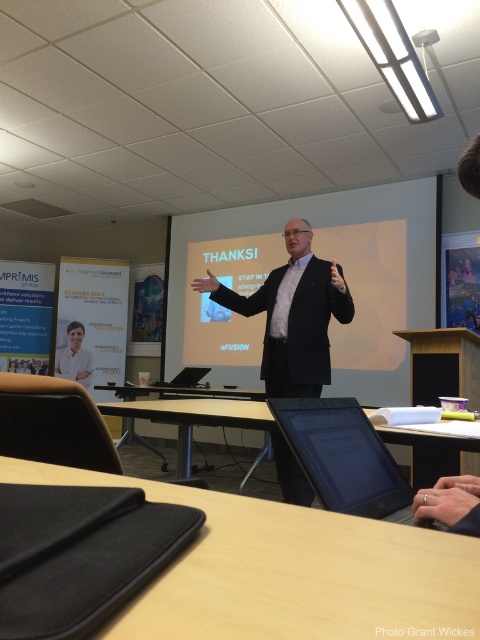
Can you confirm if black matte screen at lower center is positioned above silver metallic ring at lower center?

Incorrect, black matte screen at lower center is not positioned above silver metallic ring at lower center.

This screenshot has width=480, height=640. I want to click on black matte screen at lower center, so click(x=342, y=456).

Between white matte projection screen at center and brown wooden table at center, which one appears on the right side from the viewer's perspective?

white matte projection screen at center is more to the right.

Does point (238, 317) come behind point (186, 438)?

Yes.

The height and width of the screenshot is (640, 480). I want to click on white matte projection screen at center, so click(x=324, y=257).

Can you confirm if brown wooden table at center is positioned below matte white shirt at left?

Indeed, brown wooden table at center is positioned under matte white shirt at left.

This screenshot has height=640, width=480. What do you see at coordinates (193, 419) in the screenshot?
I see `brown wooden table at center` at bounding box center [193, 419].

Find the location of a particular element. The height and width of the screenshot is (640, 480). brown wooden table at center is located at coordinates (193, 419).